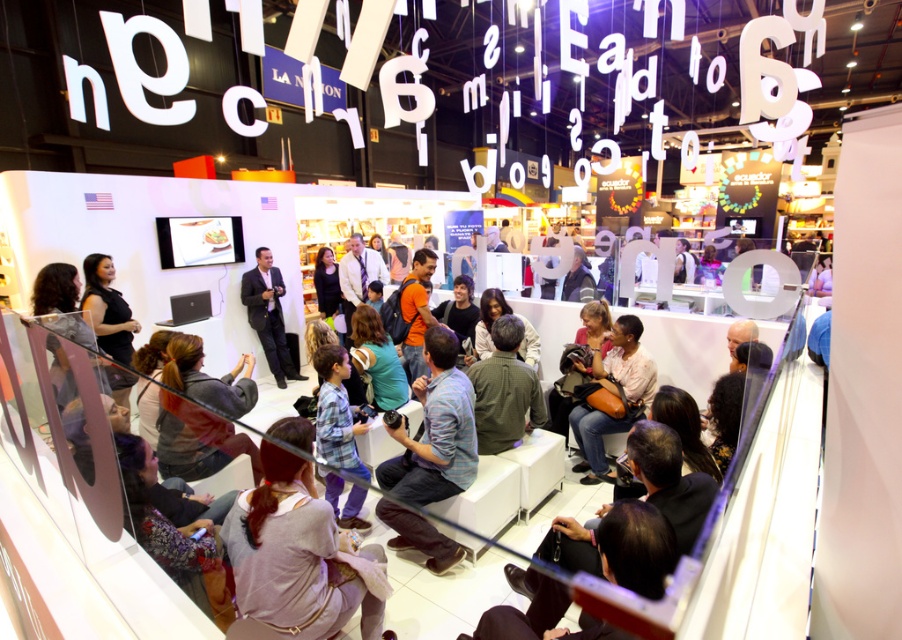
Measure the distance between leather brown handbag at center and black suit at center.

leather brown handbag at center and black suit at center are 3.66 meters apart from each other.

Can you confirm if leather brown handbag at center is smaller than black suit at center?

Indeed, leather brown handbag at center has a smaller size compared to black suit at center.

Between point (634, 387) and point (256, 266), which one is positioned behind?

The point (256, 266) is more distant.

Image resolution: width=902 pixels, height=640 pixels. I want to click on leather brown handbag at center, so click(613, 392).

Who is positioned more to the left, plaid shirt at center or black suit at center?

black suit at center

Does point (426, 387) lie behind point (256, 300)?

No, it is in front of (256, 300).

Who is more forward, (451, 476) or (263, 259)?

Point (451, 476) is more forward.

What are the coordinates of `plaid shirt at center` in the screenshot? It's located at (435, 429).

Between plaid shirt at center and leather brown handbag at center, which one has less height?

Standing shorter between the two is leather brown handbag at center.

This screenshot has width=902, height=640. Describe the element at coordinates (435, 429) in the screenshot. I see `plaid shirt at center` at that location.

Identify the location of plaid shirt at center. This screenshot has height=640, width=902. (435, 429).